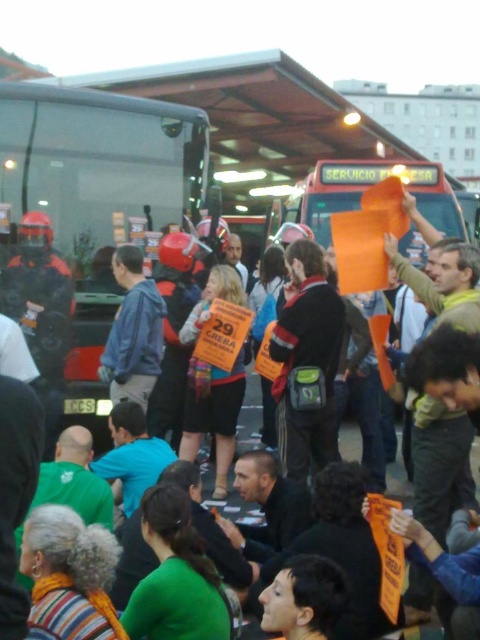
Question: From the image, what is the correct spatial relationship of transparent glass bus at left in relation to dark gray fabric jacket at center?

Choices:
 (A) below
 (B) above

Answer: (B)

Question: Does transparent glass bus at left have a smaller size compared to dark gray fabric jacket at center?

Choices:
 (A) no
 (B) yes

Answer: (A)

Question: Among these points, which one is farthest from the camera?

Choices:
 (A) (274, 387)
 (B) (58, 109)

Answer: (B)

Question: Which point is farther from the camera taking this photo?

Choices:
 (A) (104, 317)
 (B) (292, 422)

Answer: (A)

Question: Which point is farther from the camera taking this photo?

Choices:
 (A) (338, 296)
 (B) (7, 305)

Answer: (B)

Question: Does transparent glass bus at left appear over dark gray fabric jacket at center?

Choices:
 (A) no
 (B) yes

Answer: (B)